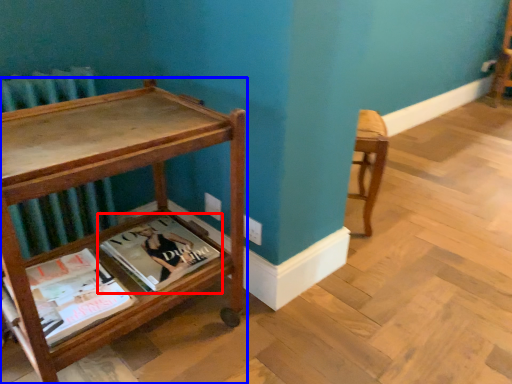
Question: Which object appears closest to the camera in this image, book (highlighted by a red box) or table (highlighted by a blue box)?

Choices:
 (A) book
 (B) table

Answer: (B)